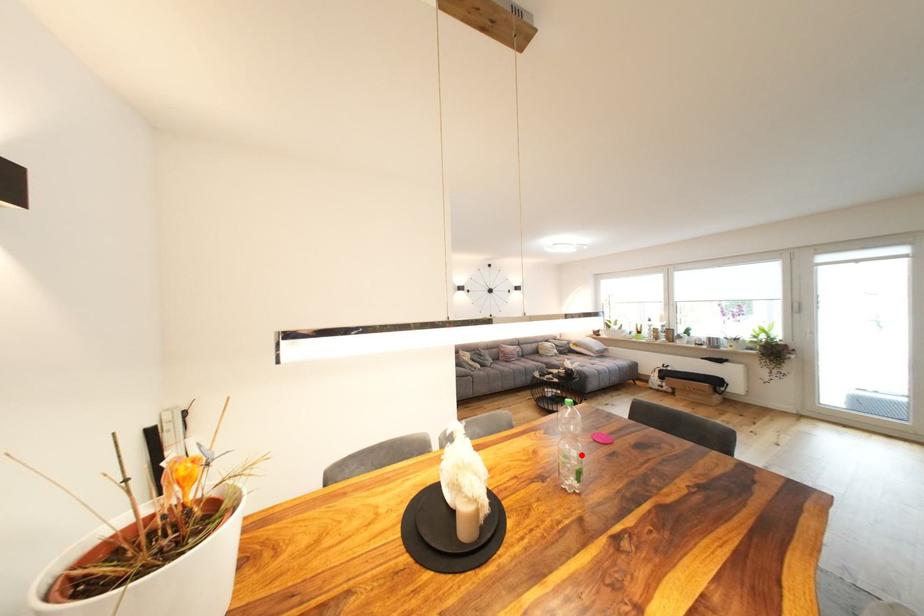
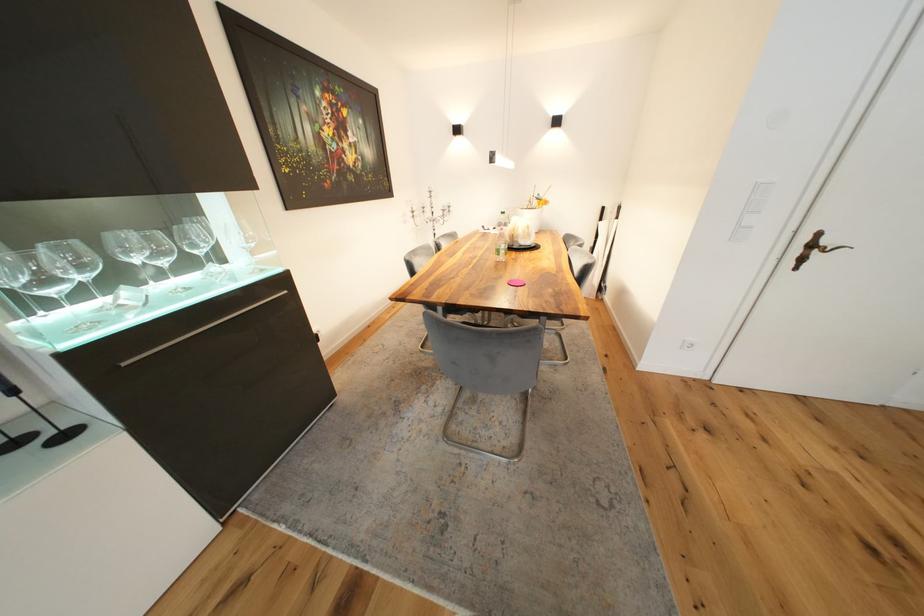
In the second image, find the point that corresponds to the highlighted location in the first image.

(511, 248)